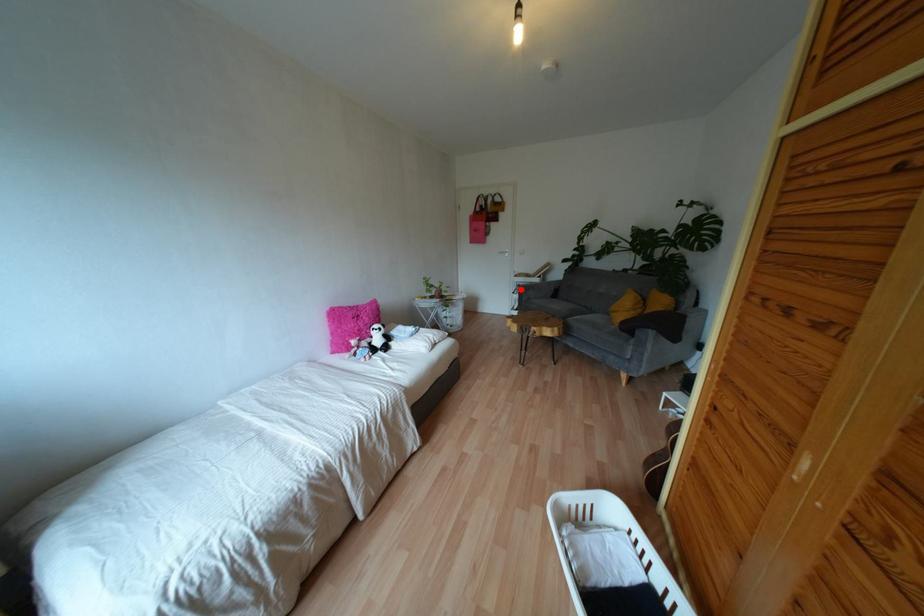
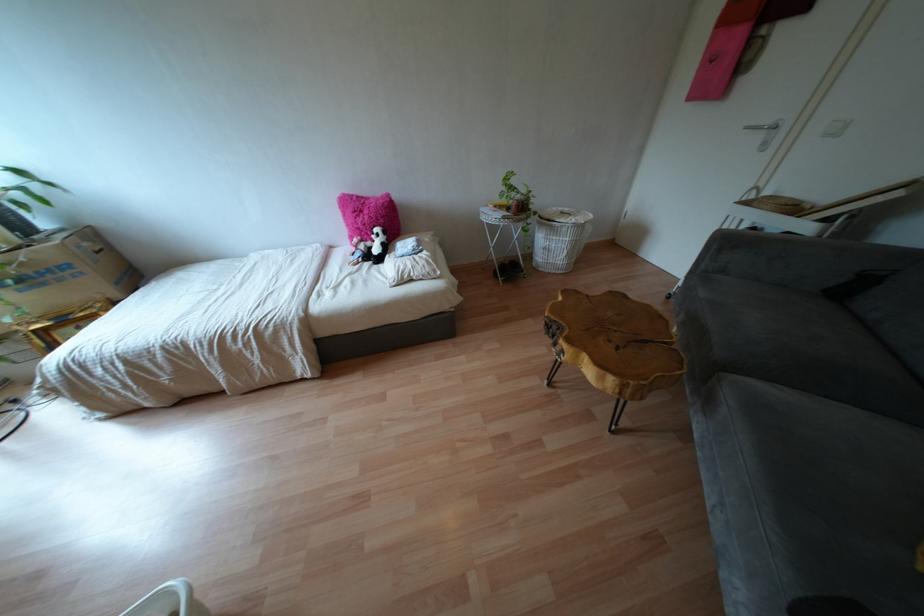
Locate, in the second image, the point that corresponds to the highlighted location in the first image.

(723, 243)